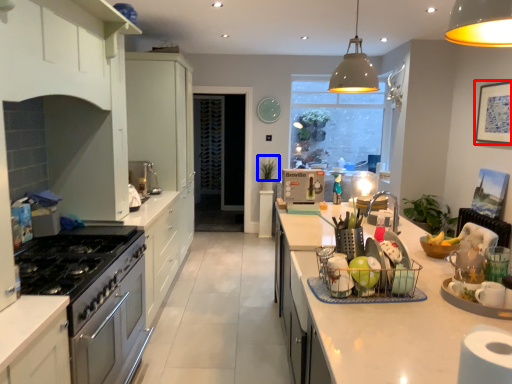
Question: Which object appears farthest to the camera in this image, picture frame (highlighted by a red box) or plant (highlighted by a blue box)?

Choices:
 (A) picture frame
 (B) plant

Answer: (B)